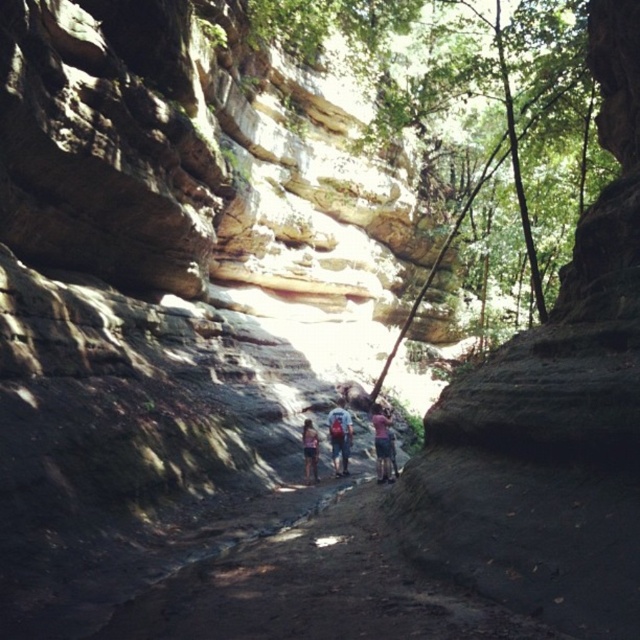
Question: Considering the relative positions of pink fabric at center and denim shorts at center in the image provided, where is pink fabric at center located with respect to denim shorts at center?

Choices:
 (A) right
 (B) left

Answer: (A)

Question: In this image, where is camouflage fabric backpack at center located relative to pink fabric at center?

Choices:
 (A) left
 (B) right

Answer: (A)

Question: Which point is farther from the camera taking this photo?

Choices:
 (A) (380, 442)
 (B) (316, 436)

Answer: (B)

Question: Estimate the real-world distances between objects in this image. Which object is closer to the denim shorts at center?

Choices:
 (A) pink fabric at center
 (B) camouflage fabric backpack at center

Answer: (B)

Question: Among these objects, which one is nearest to the camera?

Choices:
 (A) camouflage fabric backpack at center
 (B) denim shorts at center
 (C) pink fabric at center

Answer: (C)

Question: Considering the relative positions of camouflage fabric backpack at center and denim shorts at center in the image provided, where is camouflage fabric backpack at center located with respect to denim shorts at center?

Choices:
 (A) right
 (B) left

Answer: (A)